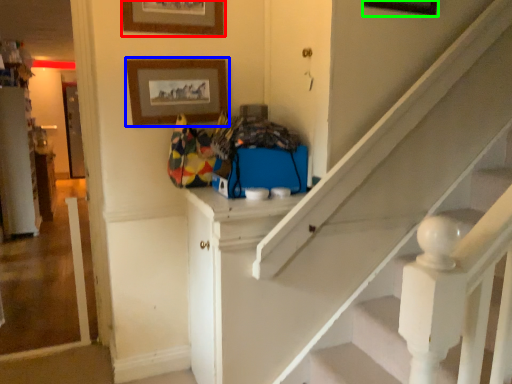
Question: Based on their relative distances, which object is farther from picture frame (highlighted by a red box)? Choose from picture frame (highlighted by a blue box) and picture frame (highlighted by a green box).

Choices:
 (A) picture frame
 (B) picture frame

Answer: (B)